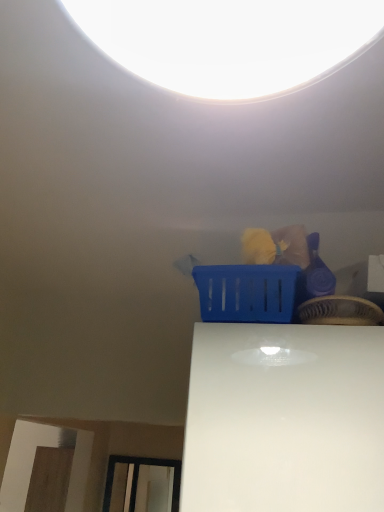
Question: From a real-world perspective, is blue plastic basket at upper center, placed as the 2th basket when sorted from left to right, positioned under blue plastic basket at upper center, the 1th basket when ordered from left to right, based on gravity?

Choices:
 (A) yes
 (B) no

Answer: (A)

Question: Is blue plastic basket at upper center, placed as the 2th basket when sorted from left to right, oriented away from blue plastic basket at upper center, the 1th basket when ordered from left to right?

Choices:
 (A) yes
 (B) no

Answer: (B)

Question: Is the depth of blue plastic basket at upper center, acting as the first basket starting from the right, less than that of blue plastic basket at upper center, which is the second basket in right-to-left order?

Choices:
 (A) no
 (B) yes

Answer: (B)

Question: Is blue plastic basket at upper center, acting as the first basket starting from the right, completely or partially outside of blue plastic basket at upper center, which is the second basket in right-to-left order?

Choices:
 (A) no
 (B) yes

Answer: (B)

Question: Considering the relative positions of blue plastic basket at upper center, acting as the first basket starting from the right, and blue plastic basket at upper center, which is the second basket in right-to-left order, in the image provided, is blue plastic basket at upper center, acting as the first basket starting from the right, to the right of blue plastic basket at upper center, which is the second basket in right-to-left order, from the viewer's perspective?

Choices:
 (A) no
 (B) yes

Answer: (B)

Question: Can you confirm if blue plastic basket at upper center, acting as the first basket starting from the right, is shorter than blue plastic basket at upper center, the 1th basket when ordered from left to right?

Choices:
 (A) no
 (B) yes

Answer: (B)

Question: Is blue plastic basket at upper center, the 1th basket when ordered from left to right, thinner than blue plastic basket at upper center, acting as the first basket starting from the right?

Choices:
 (A) yes
 (B) no

Answer: (B)

Question: Can you confirm if blue plastic basket at upper center, the 1th basket when ordered from left to right, is wider than blue plastic basket at upper center, acting as the first basket starting from the right?

Choices:
 (A) no
 (B) yes

Answer: (B)

Question: Is blue plastic basket at upper center, which is the second basket in right-to-left order, taller than blue plastic basket at upper center, placed as the 2th basket when sorted from left to right?

Choices:
 (A) no
 (B) yes

Answer: (B)

Question: Is blue plastic basket at upper center, the 1th basket when ordered from left to right, smaller than blue plastic basket at upper center, acting as the first basket starting from the right?

Choices:
 (A) yes
 (B) no

Answer: (B)

Question: From a real-world perspective, is blue plastic basket at upper center, which is the second basket in right-to-left order, physically below blue plastic basket at upper center, placed as the 2th basket when sorted from left to right?

Choices:
 (A) no
 (B) yes

Answer: (A)

Question: Is blue plastic basket at upper center, which is the second basket in right-to-left order, far away from blue plastic basket at upper center, acting as the first basket starting from the right?

Choices:
 (A) yes
 (B) no

Answer: (B)

Question: Visually, is blue plastic basket at upper center, placed as the 2th basket when sorted from left to right, positioned to the left or to the right of blue plastic basket at upper center, which is the second basket in right-to-left order?

Choices:
 (A) left
 (B) right

Answer: (B)